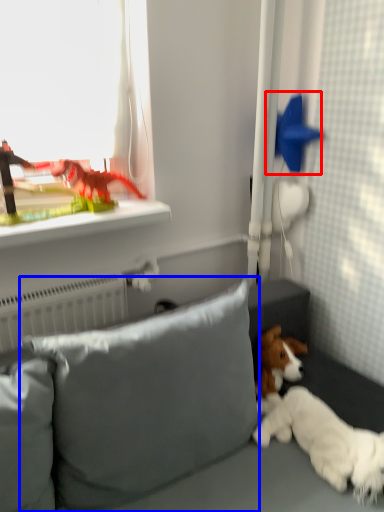
Question: Which point is closer to the camera, toy (highlighted by a red box) or pillow (highlighted by a blue box)?

Choices:
 (A) toy
 (B) pillow

Answer: (B)